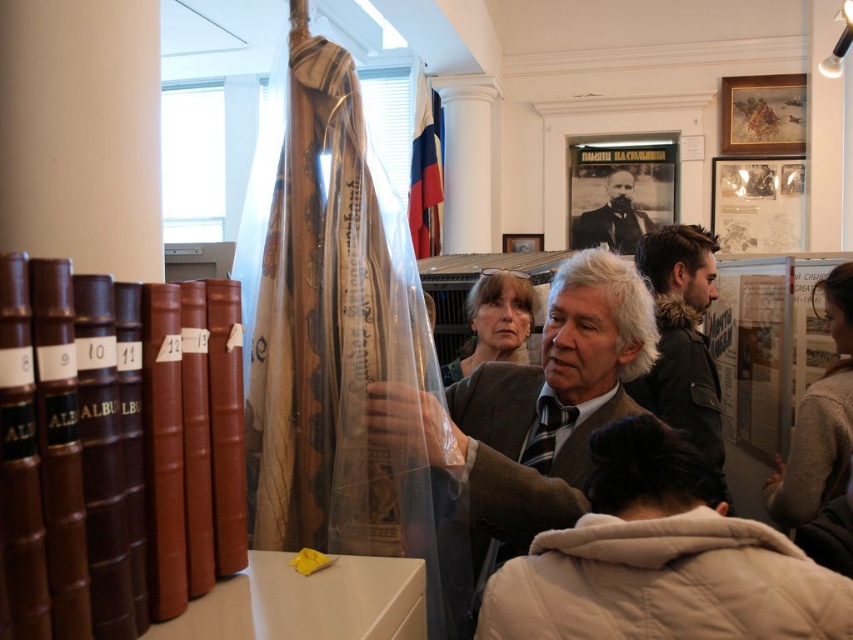
You are a visitor at the museum and want to take a photo of both the matte gray jacket at center and the smooth black suit at center. Since you are standing in front of them, which one should you focus on first to ensure both are in the frame?

The matte gray jacket at center is below the smooth black suit at center, so you should focus on the smooth black suit at center first to ensure both are in the frame.

You are a visitor at the museum and want to take a photo of both the matte brown suit at center and the smooth black suit at center. Since you want them both in the frame, which one should you focus on to ensure both are visible?

You should focus on the matte brown suit at center because it is larger in size than the smooth black suit at center, making it easier to capture both in the frame.

You are a security guard in the museum and need to check both the matte brown suit at center and the smooth black suit at center. If your security device has a maximum scanning range of 3 meters, can you scan both suits without moving closer?

The distance between the matte brown suit at center and the smooth black suit at center is 3.17 meters, which exceeds the 3 meter scanning range of your device. You will need to move closer to scan both suits.